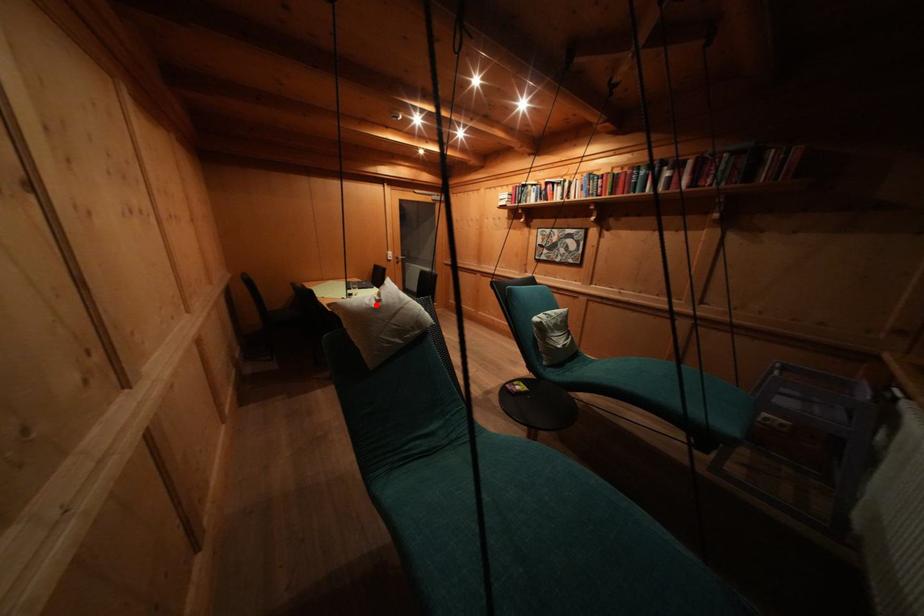
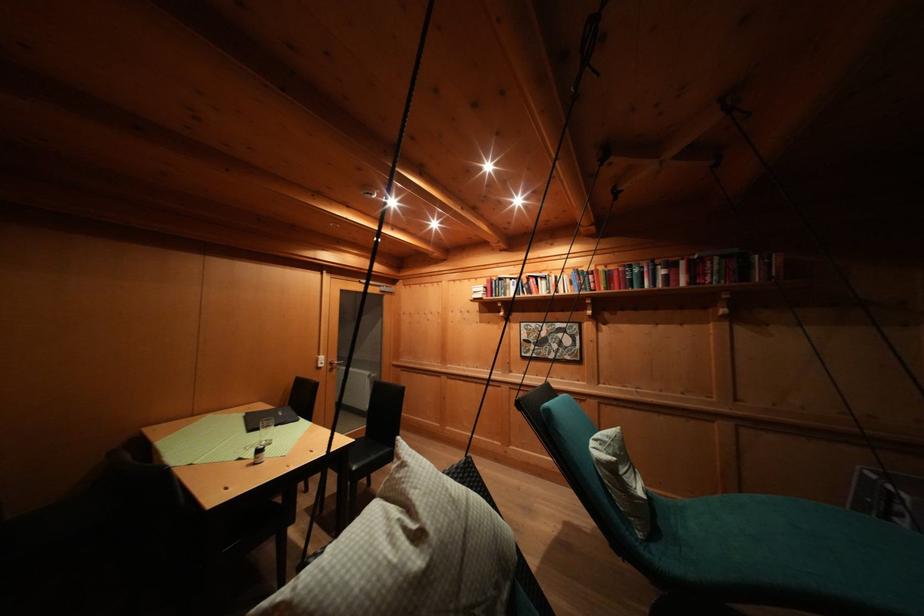
In the second image, find the point that corresponds to the highlighted location in the first image.

(396, 541)